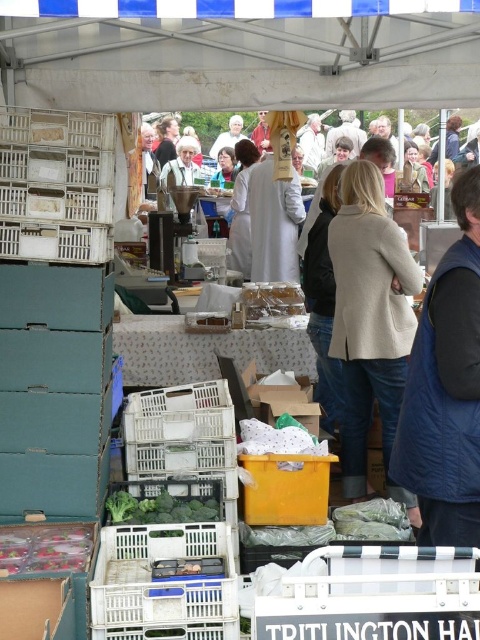
Based on the photo, can you confirm if green leafy vegetables at center is smaller than translucent plastic bag at center?

Yes.

Who is lower down, green leafy vegetables at center or translucent plastic bag at center?

green leafy vegetables at center is lower down.

The width and height of the screenshot is (480, 640). What do you see at coordinates (159, 508) in the screenshot?
I see `green leafy vegetables at center` at bounding box center [159, 508].

The image size is (480, 640). What are the coordinates of `green leafy vegetables at center` in the screenshot? It's located at coord(159,508).

Which is below, beige wool coat at center or white plastic crate at lower left?

white plastic crate at lower left is lower down.

What do you see at coordinates (371, 321) in the screenshot?
I see `beige wool coat at center` at bounding box center [371, 321].

Find the location of a particular element. This screenshot has height=640, width=480. beige wool coat at center is located at coordinates (371, 321).

Is beige wool coat at center positioned at the back of translucent plastic bag at lower left?

Yes.

Find the location of a particular element. The height and width of the screenshot is (640, 480). beige wool coat at center is located at coordinates (371, 321).